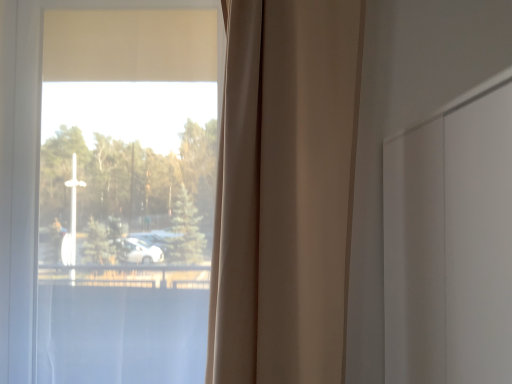
Question: Based on their sizes in the image, would you say beige fabric curtain at center is bigger or smaller than transparent glass window at center?

Choices:
 (A) big
 (B) small

Answer: (B)

Question: From a real-world perspective, relative to transparent glass window at center, is beige fabric curtain at center vertically above or below?

Choices:
 (A) below
 (B) above

Answer: (B)

Question: Is point 318,18 positioned closer to the camera than point 8,57?

Choices:
 (A) farther
 (B) closer

Answer: (B)

Question: From a real-world perspective, is transparent glass window at center above or below beige fabric curtain at center?

Choices:
 (A) below
 (B) above

Answer: (A)

Question: Considering their positions, is transparent glass window at center located in front of or behind beige fabric curtain at center?

Choices:
 (A) behind
 (B) front

Answer: (A)

Question: Is transparent glass window at center inside the boundaries of beige fabric curtain at center, or outside?

Choices:
 (A) inside
 (B) outside

Answer: (B)

Question: Is transparent glass window at center wider or thinner than beige fabric curtain at center?

Choices:
 (A) wide
 (B) thin

Answer: (A)